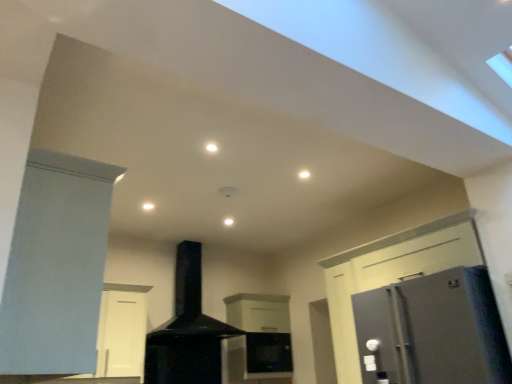
Question: Is white matte cabinet at center, the first cabinetry viewed from the back, directly adjacent to satin silver refrigerator at right?

Choices:
 (A) no
 (B) yes

Answer: (A)

Question: Does white matte cabinet at center, the first cabinetry viewed from the back, have a smaller size compared to satin silver refrigerator at right?

Choices:
 (A) yes
 (B) no

Answer: (A)

Question: Is white matte cabinet at center, the 1th cabinetry when ordered from right to left, turned away from satin silver refrigerator at right?

Choices:
 (A) no
 (B) yes

Answer: (A)

Question: Is white matte cabinet at center, the first cabinetry viewed from the back, wider than satin silver refrigerator at right?

Choices:
 (A) yes
 (B) no

Answer: (B)

Question: From the image's perspective, would you say white matte cabinet at center, placed as the second cabinetry when sorted from left to right, is positioned over satin silver refrigerator at right?

Choices:
 (A) yes
 (B) no

Answer: (B)

Question: From a real-world perspective, is white matte cabinet at center, the first cabinetry viewed from the back, above or below black matte chimney at center?

Choices:
 (A) below
 (B) above

Answer: (A)

Question: Based on their positions, is white matte cabinet at center, placed as the second cabinetry when sorted from left to right, located to the left or right of black matte chimney at center?

Choices:
 (A) left
 (B) right

Answer: (B)

Question: From the image's perspective, is white matte cabinet at center, the first cabinetry viewed from the back, above or below black matte chimney at center?

Choices:
 (A) below
 (B) above

Answer: (A)

Question: From their relative heights in the image, would you say white matte cabinet at center, the 2th cabinetry from the front, is taller or shorter than black matte chimney at center?

Choices:
 (A) short
 (B) tall

Answer: (A)

Question: Considering the positions of black matte chimney at center and matte white cabinet at left, the 1th cabinetry viewed from the left, in the image, is black matte chimney at center bigger or smaller than matte white cabinet at left, the 1th cabinetry viewed from the left,?

Choices:
 (A) big
 (B) small

Answer: (B)

Question: Would you say black matte chimney at center is inside or outside matte white cabinet at left, the second cabinetry viewed from the right?

Choices:
 (A) outside
 (B) inside

Answer: (A)

Question: Considering the positions of black matte chimney at center and matte white cabinet at left, the second cabinetry viewed from the right, in the image, is black matte chimney at center taller or shorter than matte white cabinet at left, the second cabinetry viewed from the right,?

Choices:
 (A) short
 (B) tall

Answer: (B)

Question: Considering the positions of point (199, 360) and point (58, 155), is point (199, 360) closer or farther from the camera than point (58, 155)?

Choices:
 (A) farther
 (B) closer

Answer: (A)

Question: Is point (258, 349) positioned closer to the camera than point (31, 291)?

Choices:
 (A) farther
 (B) closer

Answer: (A)

Question: Is white matte cabinet at center, the 2th cabinetry from the front, taller or shorter than matte white cabinet at left, the first cabinetry when ordered from front to back?

Choices:
 (A) tall
 (B) short

Answer: (A)